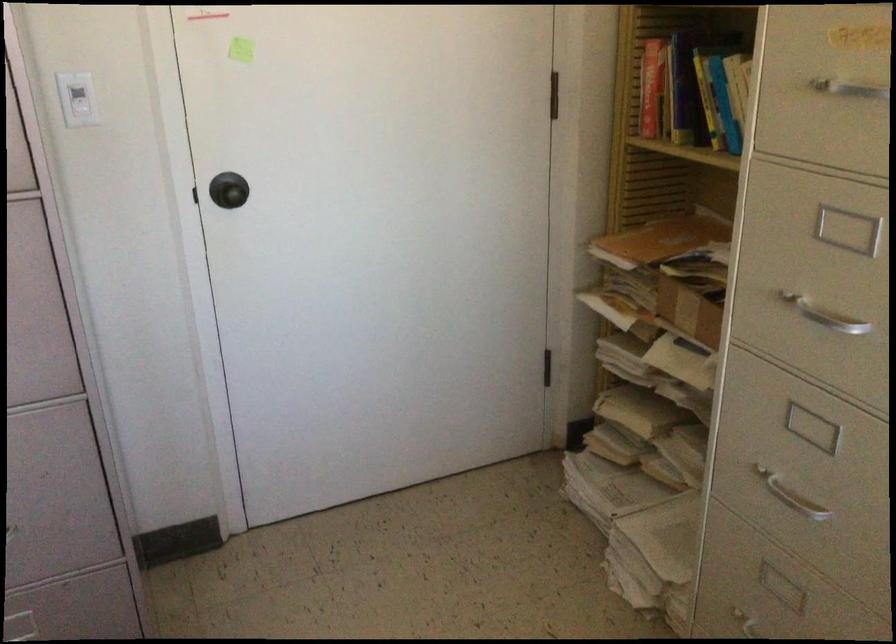
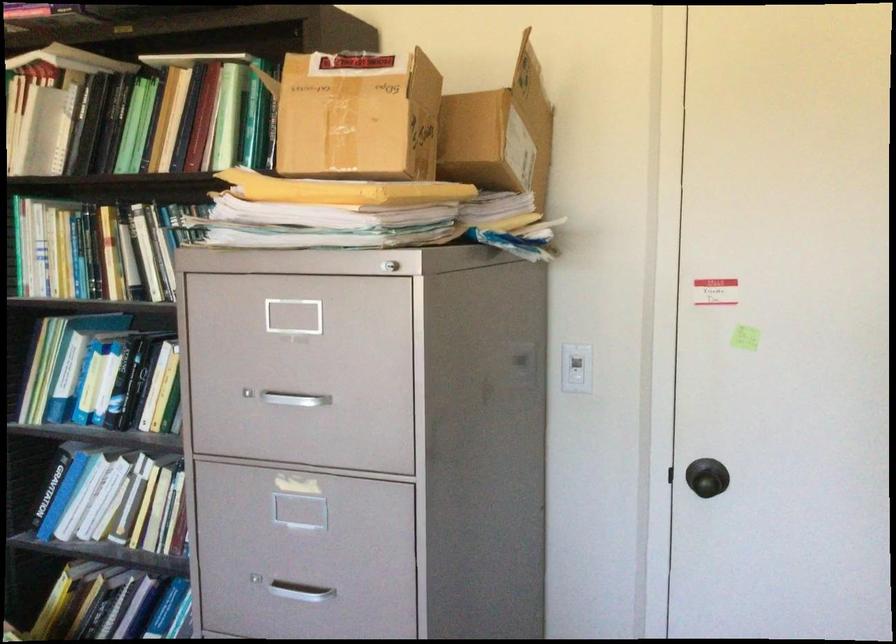
Question: Based on the continuous images, in which direction is the camera rotating? Reply with the corresponding letter.

Choices:
 (A) Left
 (B) Right
 (C) Up
 (D) Down

Answer: (A)